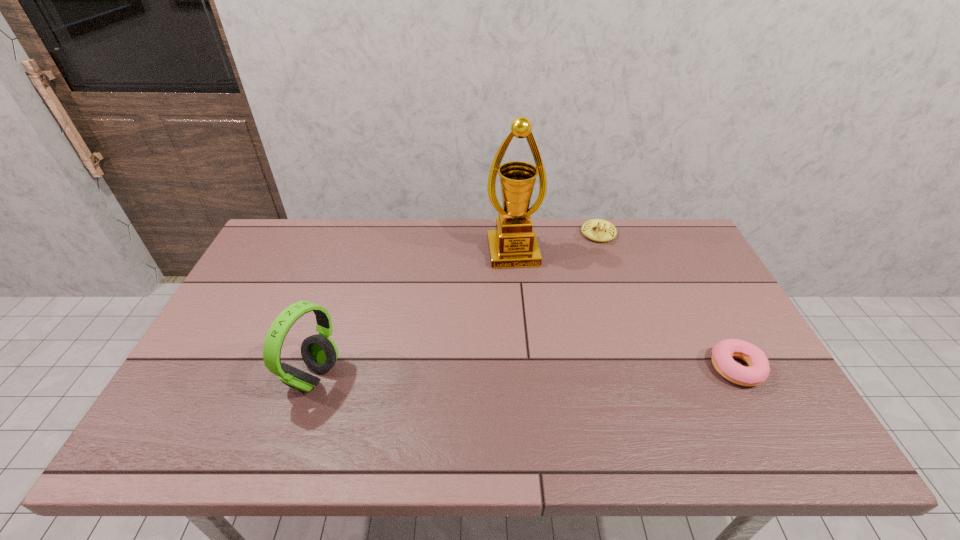
Where is `object that stands as the third closest to the shortest object`? object that stands as the third closest to the shortest object is located at coordinates (319, 352).

Locate an element on the screen. This screenshot has height=540, width=960. free spot that satisfies the following two spatial constraints: 1. on the back side of the third object from right to left; 2. on the right side of the second tallest object is located at coordinates (355, 252).

At what (x,y) coordinates should I click in order to perform the action: click on vacant point that satisfies the following two spatial constraints: 1. on the back side of the tallest object; 2. on the left side of the third object from left to right. Please return your answer as a coordinate pair (x, y). Looking at the image, I should click on (512, 234).